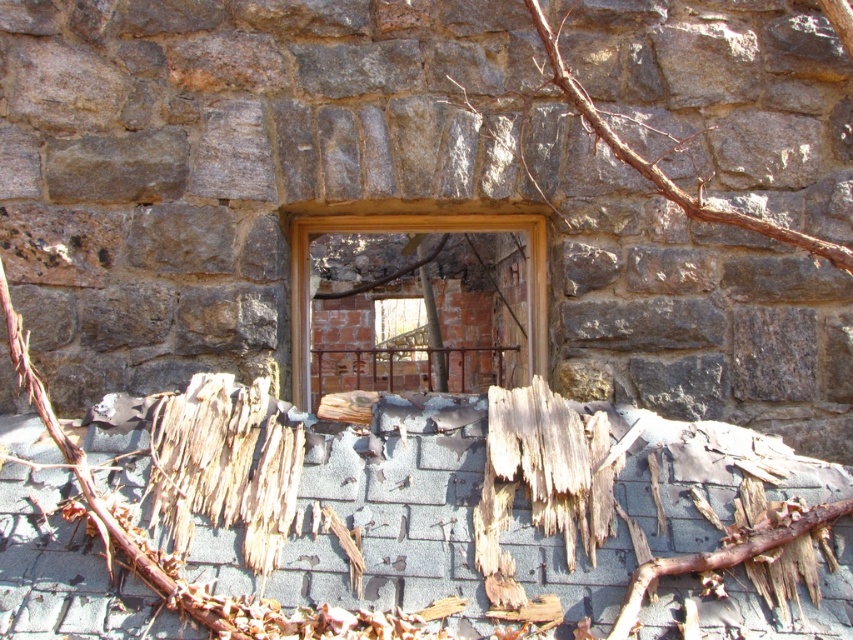
Is wooden frame at center positioned in front of brown rough wood at lower center?

No, it is not.

Does point (289, 269) come closer to viewer compared to point (821, 512)?

No, it is behind (821, 512).

Locate an element on the screen. The width and height of the screenshot is (853, 640). wooden frame at center is located at coordinates (410, 232).

Identify the location of wooden frame at center. (410, 232).

Can you confirm if brown weathered wood at lower center is smaller than brown woody branch at upper center?

Yes, brown weathered wood at lower center is smaller than brown woody branch at upper center.

Is point (556, 456) farther from camera compared to point (735, 221)?

No, (556, 456) is in front of (735, 221).

Find the location of `brown weathered wood at lower center`. brown weathered wood at lower center is located at coordinates (544, 472).

Locate an element on the screen. Image resolution: width=853 pixels, height=640 pixels. brown weathered wood at lower center is located at coordinates (544, 472).

Can you confirm if brown woody branch at upper center is positioned to the left of brown rough wood at lower center?

Incorrect, brown woody branch at upper center is not on the left side of brown rough wood at lower center.

Which is in front, point (737, 221) or point (647, 563)?

Point (647, 563)

Who is more distant from viewer, (579, 86) or (674, 564)?

The point (579, 86) is behind.

Find the location of `brown woody branch at upper center`. brown woody branch at upper center is located at coordinates (660, 170).